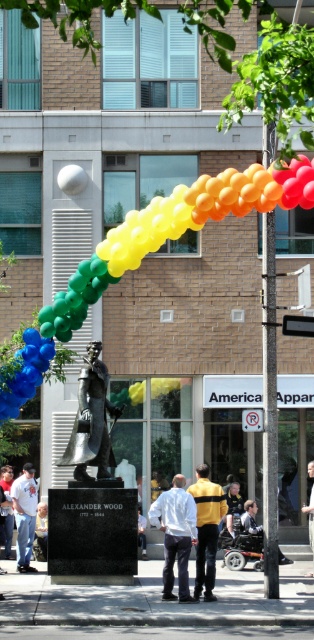
You are a photographer positioned in front of the statue and the building. You want to capture a photo where the bronze statue at center and the white matte shirt at center are both clearly visible. Based on their positions, which object should appear higher in the photo?

The bronze statue at center is above the white matte shirt at center, so it will appear higher in the photo.